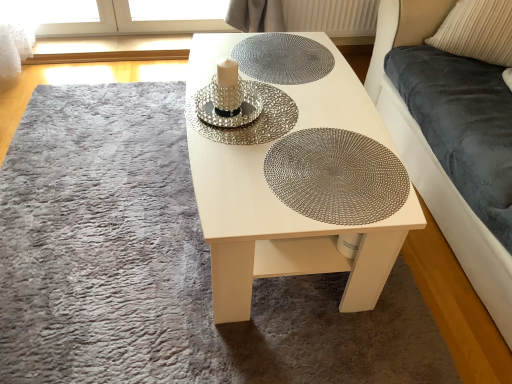
Find the location of a particular element. The width and height of the screenshot is (512, 384). vacant space underneath metallic textured glass plate at center, which ranks as the 1th glass plate in top-to-bottom order (from a real-world perspective) is located at coordinates (280, 63).